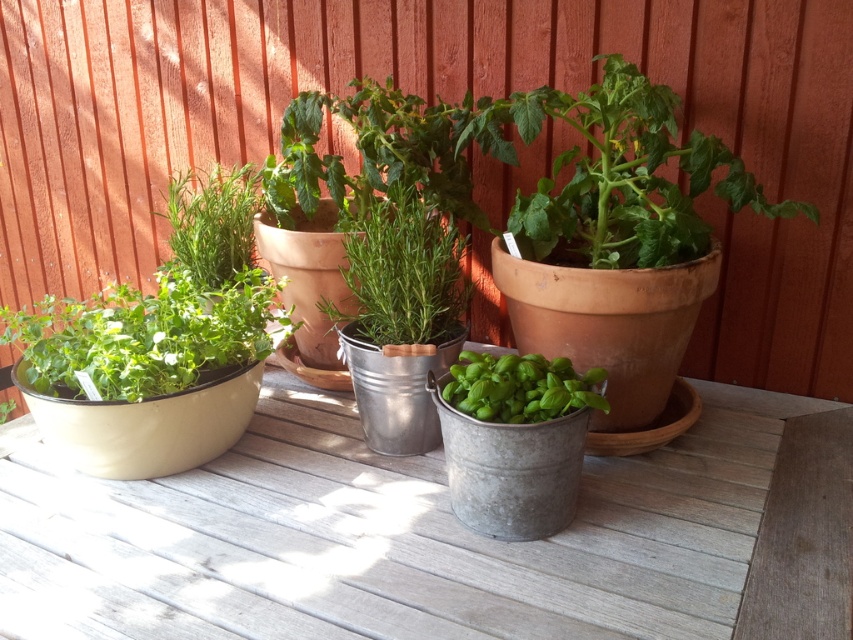
You are a gardener who wants to arrange two herbs in order of their widths from widest to narrowest. Given the green matte herb at left and the green matte herb at center, which one should come first?

The green matte herb at left should come first since its width surpasses the green matte herb at center.

You are standing at the center of the wooden surface where the potted plants are arranged. There is a point marked at coordinates (213,221). Which object is located at that point?

The point at coordinates (213,221) marks the green matte herb at upper left.

You are a gardener who needs to water the plants. Your watering can has a 0.8 meter reach. If you are standing at the position where you can reach the green matte herb at upper left, can you also water the green matte basil at center without moving your feet?

The distance between the green matte herb at upper left and the green matte basil at center is 1.00 meters. Since your watering can only reaches 0.8 meters, you cannot water the green matte basil at center without moving your position.